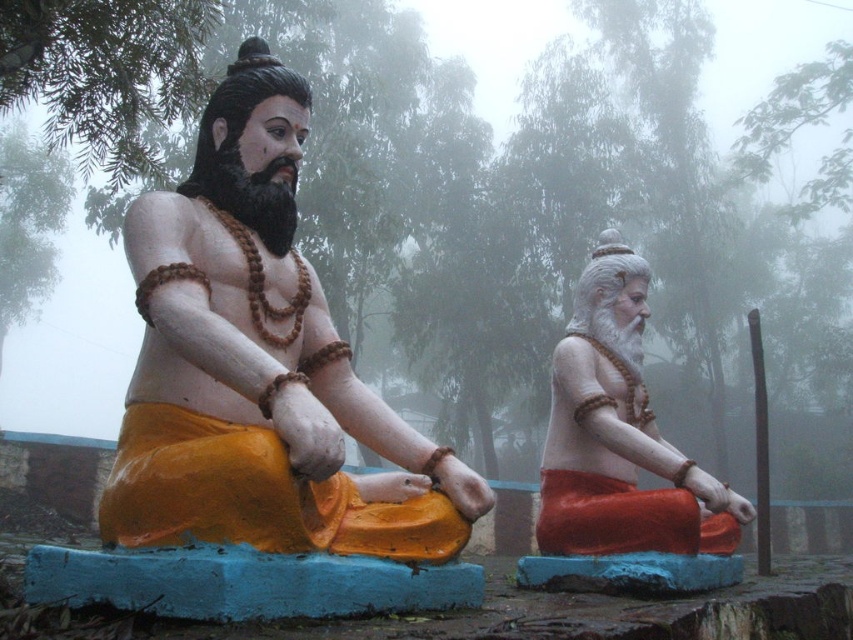
Question: Does matte orange statue at center have a smaller size compared to matte orange statue at right?

Choices:
 (A) no
 (B) yes

Answer: (A)

Question: Does matte orange statue at center appear on the right side of matte orange statue at right?

Choices:
 (A) yes
 (B) no

Answer: (B)

Question: Which of the following is the closest to the observer?

Choices:
 (A) (585, 410)
 (B) (357, 422)

Answer: (B)

Question: Which point appears closest to the camera in this image?

Choices:
 (A) (148, 250)
 (B) (585, 396)

Answer: (A)

Question: Which object is closer to the camera taking this photo?

Choices:
 (A) matte orange statue at center
 (B) matte orange statue at right

Answer: (A)

Question: Is matte orange statue at center above matte orange statue at right?

Choices:
 (A) yes
 (B) no

Answer: (A)